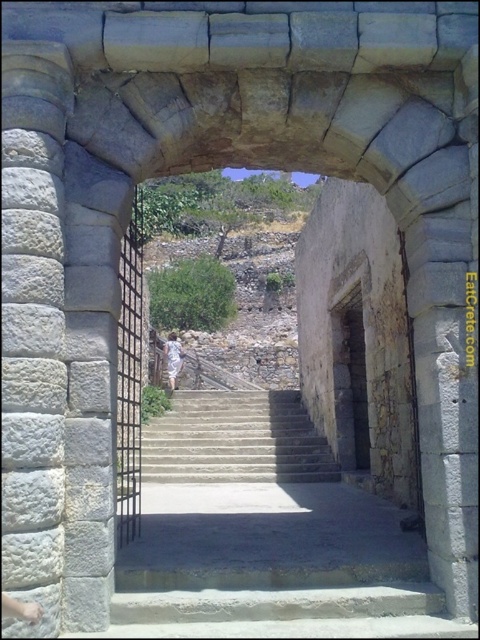
Question: Which object is closer to the camera taking this photo?

Choices:
 (A) smooth stone stairs at center
 (B) black metal gate at left
 (C) white stone pillar at left
 (D) rustic stone doorway at center

Answer: (C)

Question: In this image, where is white stone pillar at left located relative to rustic stone doorway at center?

Choices:
 (A) right
 (B) left

Answer: (B)

Question: Is smooth stone stairs at center to the left of rustic stone doorway at center from the viewer's perspective?

Choices:
 (A) no
 (B) yes

Answer: (B)

Question: Which object appears farthest from the camera in this image?

Choices:
 (A) white stone pillar at left
 (B) rustic stone doorway at center
 (C) black metal gate at left

Answer: (B)

Question: Which of the following is the farthest from the observer?

Choices:
 (A) (294, 435)
 (B) (130, 484)

Answer: (A)

Question: Is the position of white stone pillar at left more distant than that of rustic stone doorway at center?

Choices:
 (A) no
 (B) yes

Answer: (A)